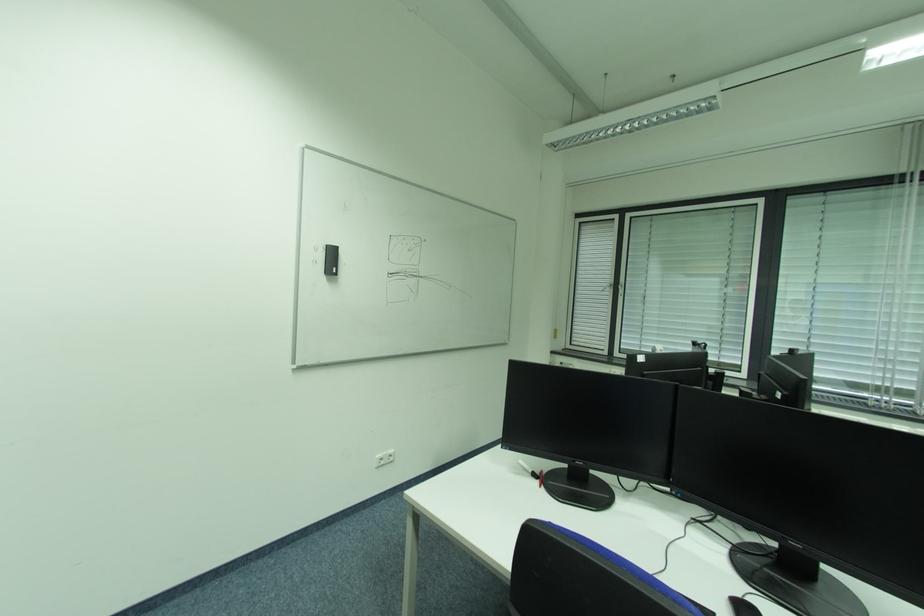
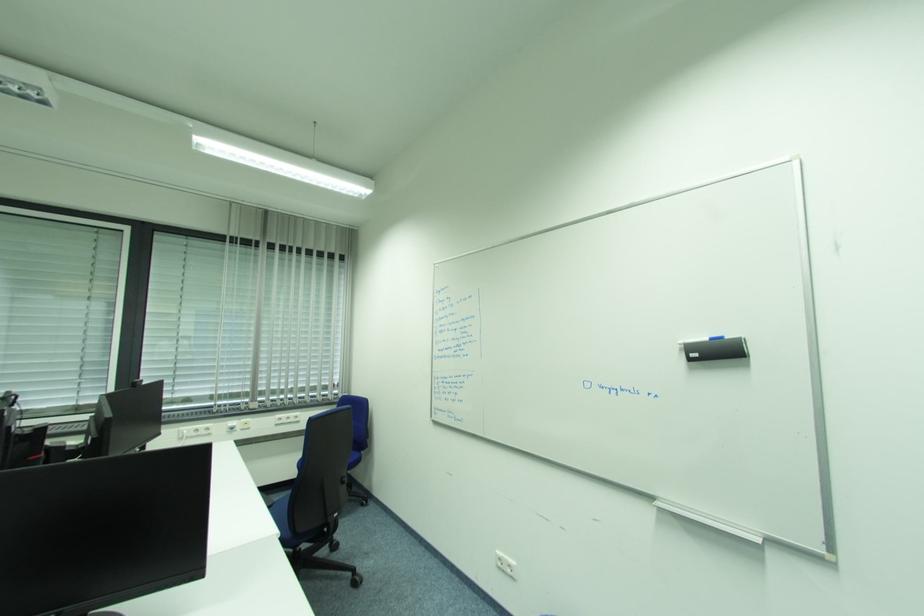
Question: The camera is either moving clockwise (left) or counter-clockwise (right) around the object. The first image is from the beginning of the video and the second image is from the end. Is the camera moving left or right when shooting the video?

Choices:
 (A) Left
 (B) Right

Answer: (A)